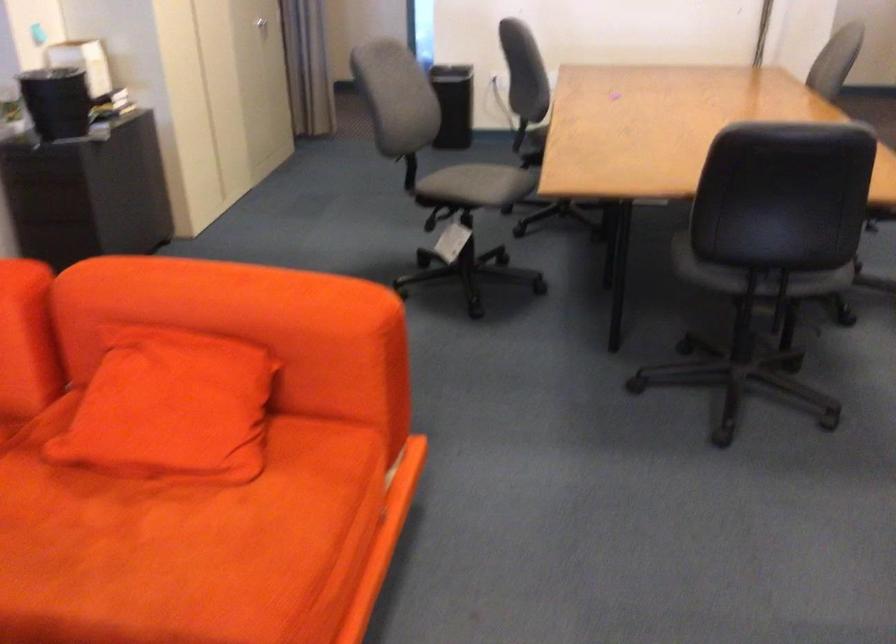
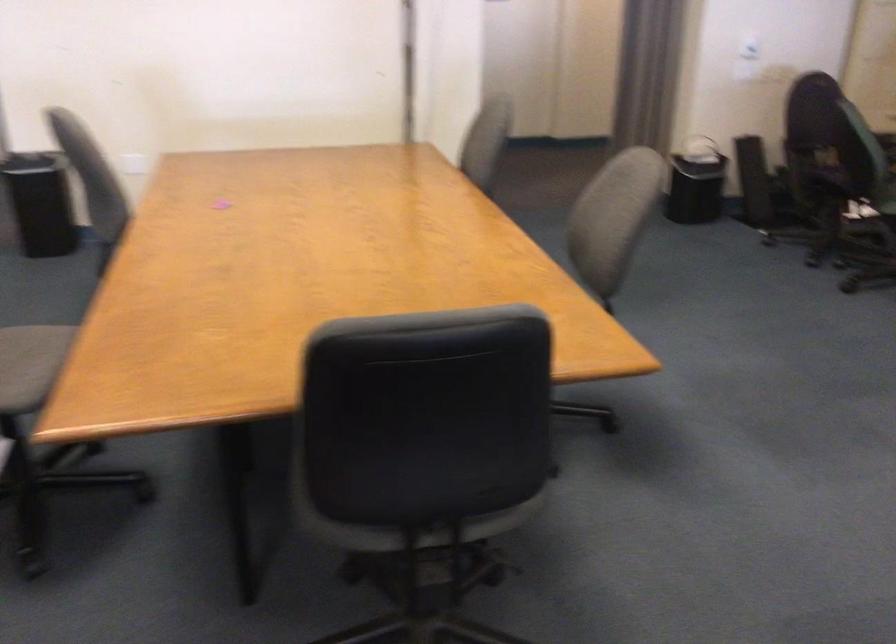
Question: The images are taken continuously from a first-person perspective. In which direction are you moving?

Choices:
 (A) Left
 (B) Right
 (C) Forward
 (D) Backward

Answer: (D)